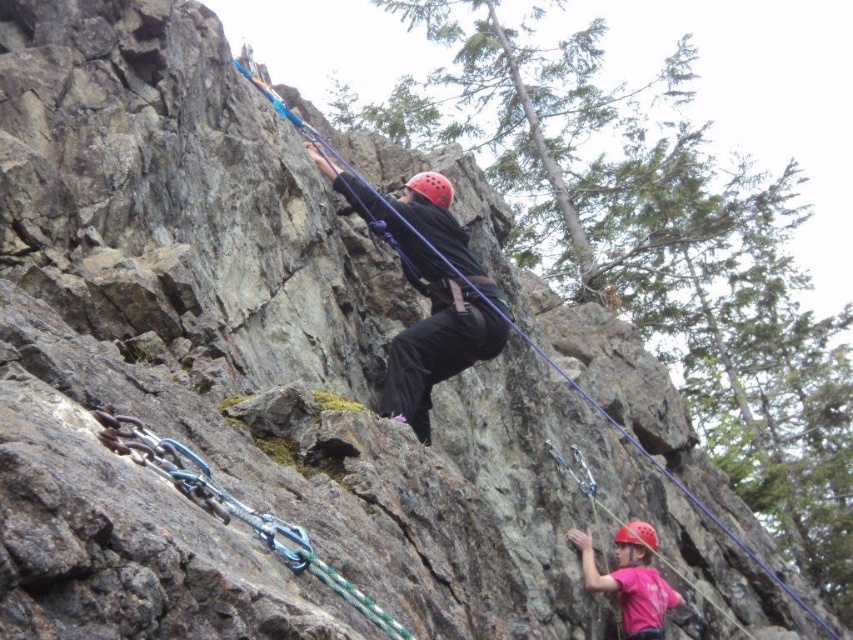
You are a photographer standing at the base of the rock face. You want to capture a photo of both the pink fabric helmet at lower right and the matte red helmet at lower right in the same frame. Which helmet will appear larger in the photo?

The pink fabric helmet at lower right is much taller than the matte red helmet at lower right, so it will appear larger in the photo.

You are a rock climber who has just reached a rest position on the rock face. You notice the matte black helmet at center and the green rope at center. Which object is positioned higher from the ground?

The matte black helmet at center is located above the green rope at center, so it is positioned higher from the ground.

You are a climber trying to reach the top of the rock face. You see a point marked at coordinates point (231, 506). What object is located at that point?

The green rope at center is located at point (231, 506).